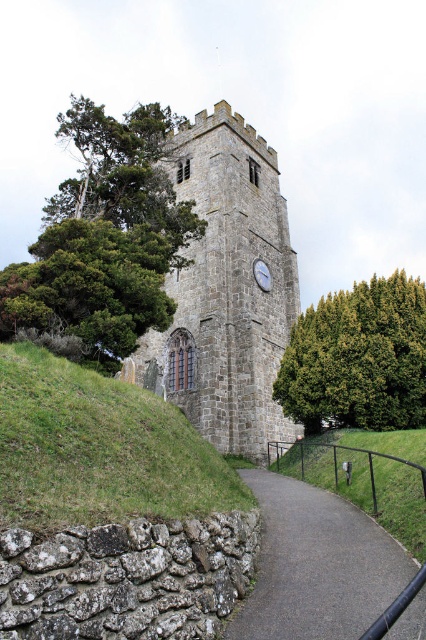
Is green grassy hillside at lower left closer to camera compared to green textured tree at center-right?

Yes.

Describe the element at coordinates (98, 449) in the screenshot. I see `green grassy hillside at lower left` at that location.

Does point (43, 515) come closer to viewer compared to point (396, 385)?

Yes, it is in front of point (396, 385).

Image resolution: width=426 pixels, height=640 pixels. I want to click on green grassy hillside at lower left, so click(x=98, y=449).

Is point (161, 465) positioned in front of point (256, 481)?

Yes.

Between green grassy hillside at lower left and black asphalt path at lower center, which one has less height?

Standing shorter between the two is black asphalt path at lower center.

Identify the location of green grassy hillside at lower left. (98, 449).

This screenshot has height=640, width=426. I want to click on green grassy hillside at lower left, so click(x=98, y=449).

Measure the distance between green grass at lower right and camera.

A distance of 98.54 feet exists between green grass at lower right and camera.

Can you confirm if green grass at lower right is thinner than silver metallic clock at center?

In fact, green grass at lower right might be wider than silver metallic clock at center.

Locate an element on the screen. green grass at lower right is located at coordinates (363, 477).